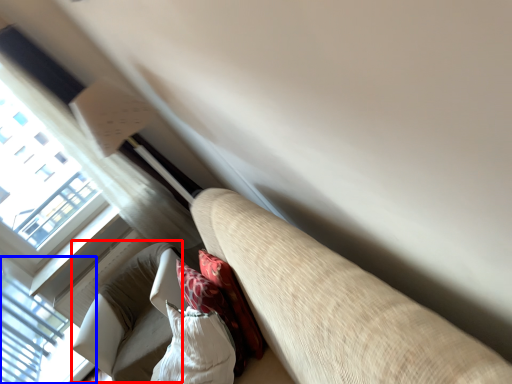
Question: Which object appears closest to the camera in this image, bean bag chair (highlighted by a red box) or window (highlighted by a blue box)?

Choices:
 (A) bean bag chair
 (B) window

Answer: (A)